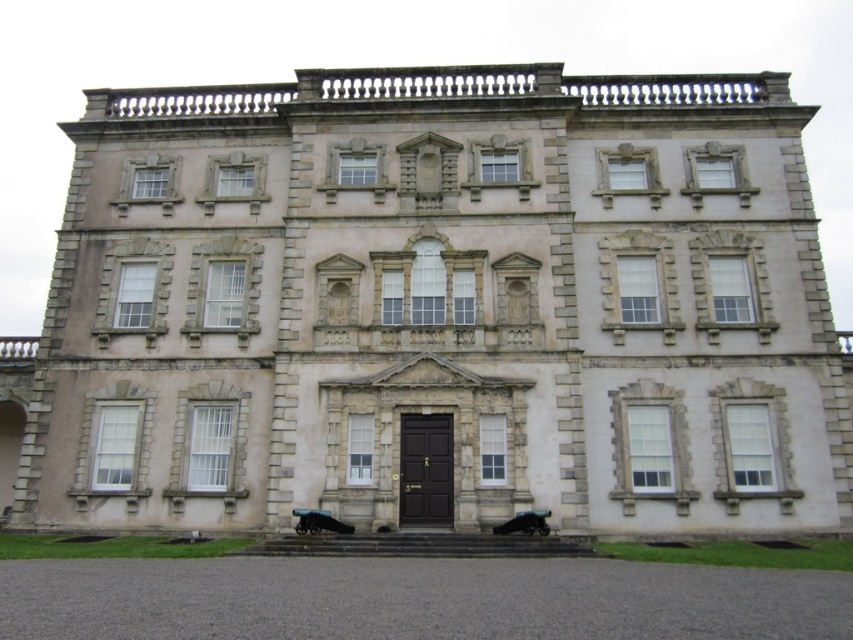
Question: Is shiny black dog at center further to the viewer compared to shiny black car at lower center?

Choices:
 (A) yes
 (B) no

Answer: (A)

Question: Among these objects, which one is farthest from the camera?

Choices:
 (A) shiny black dog at center
 (B) shiny black car at lower center

Answer: (A)

Question: Does shiny black dog at center have a smaller size compared to shiny black car at lower center?

Choices:
 (A) yes
 (B) no

Answer: (B)

Question: Which of the following is the closest to the observer?

Choices:
 (A) shiny black car at lower center
 (B) shiny black dog at center

Answer: (A)

Question: Is shiny black dog at center to the right of shiny black car at lower center from the viewer's perspective?

Choices:
 (A) yes
 (B) no

Answer: (B)

Question: Which point is closer to the camera?

Choices:
 (A) shiny black car at lower center
 (B) shiny black dog at center

Answer: (A)